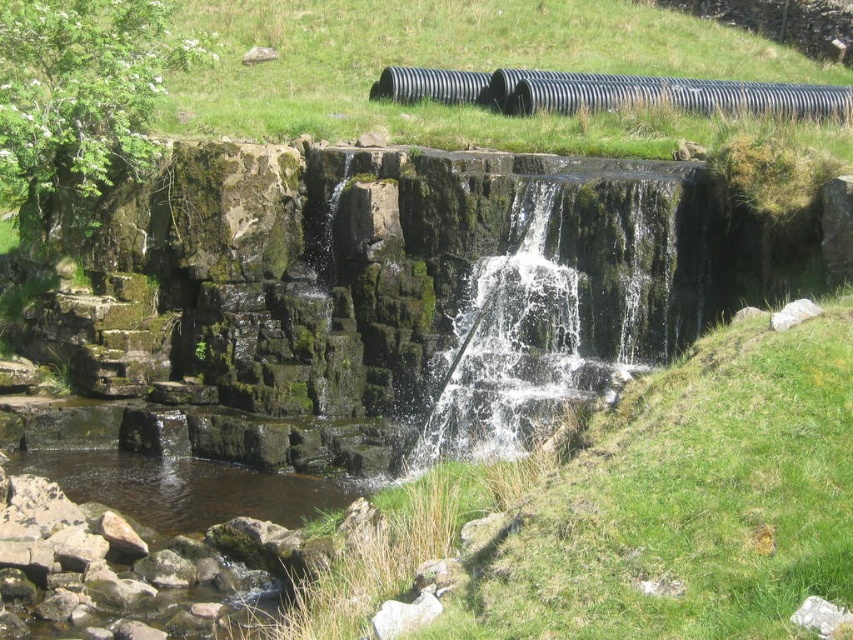
Question: Which point is closer to the camera taking this photo?

Choices:
 (A) (120, 451)
 (B) (526, 323)

Answer: (B)

Question: Which point is closer to the camera?

Choices:
 (A) (614, 81)
 (B) (520, 400)
 (C) (244, 481)

Answer: (B)

Question: Can you confirm if clear water at center is positioned to the left of clear water at lower left?

Choices:
 (A) yes
 (B) no

Answer: (B)

Question: Is clear water at center bigger than clear water at lower left?

Choices:
 (A) yes
 (B) no

Answer: (A)

Question: Which of the following is the closest to the observer?

Choices:
 (A) (666, 100)
 (B) (466, 316)

Answer: (B)

Question: Does clear water at center appear over black rubber water pipe at upper center?

Choices:
 (A) yes
 (B) no

Answer: (B)